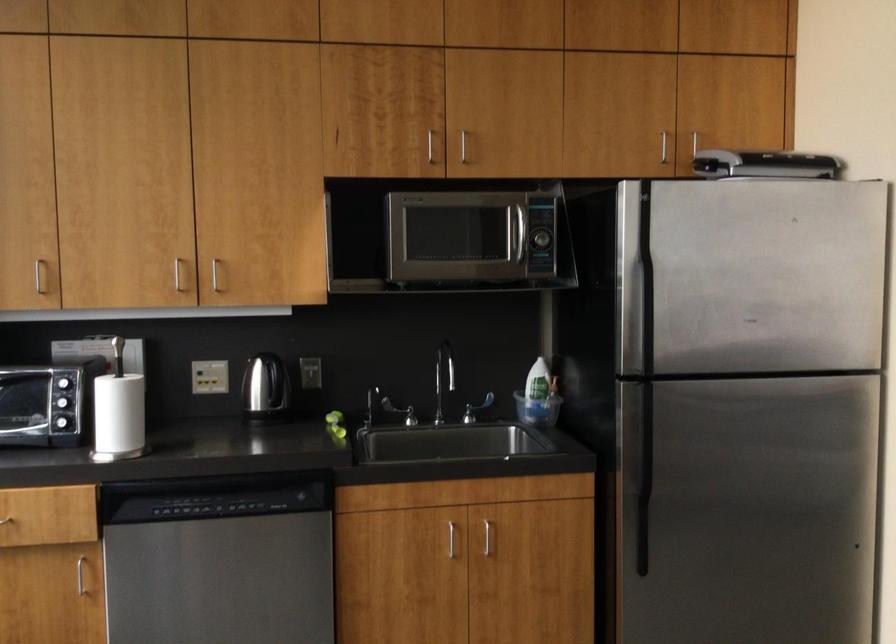
The location [266,391] corresponds to which object?

It refers to a silver electric kettle.